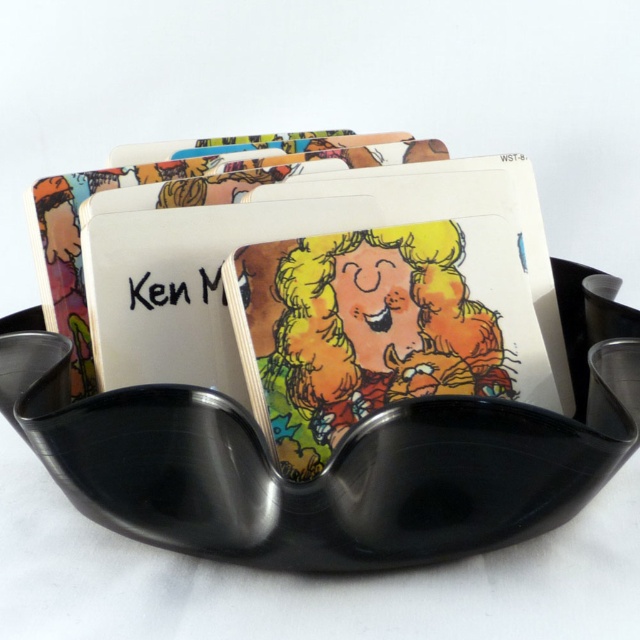
You are a delivery robot with a 7 inch wide arm. You need to place a new card between the matte cardboard card at center and the cartoon paper card at center. Can your arm fit between them without moving the existing cards?

The matte cardboard card at center and cartoon paper card at center are 6.93 inches apart from each other. Since your arm is 7 inches wide, it is slightly wider than the space between the cards. Therefore, your arm cannot fit without moving the existing cards.

Consider the image. You are standing 5 feet away from the black bowl on a plain white surface. You want to pick up the matte cardboard card at center without moving closer. Can you reach it?

The matte cardboard card at center is 3.31 feet away from the camera. Since you are standing 5 feet away from the black bowl, you cannot reach it without moving closer because the distance is greater than your current position.

You are organizing a birthday party and need to arrange the matte cardboard card at center and the cartoon paper card at center from top to bottom. Which card should be placed first at the top?

The cartoon paper card at center should be placed first at the top since the matte cardboard card at center is positioned below it.